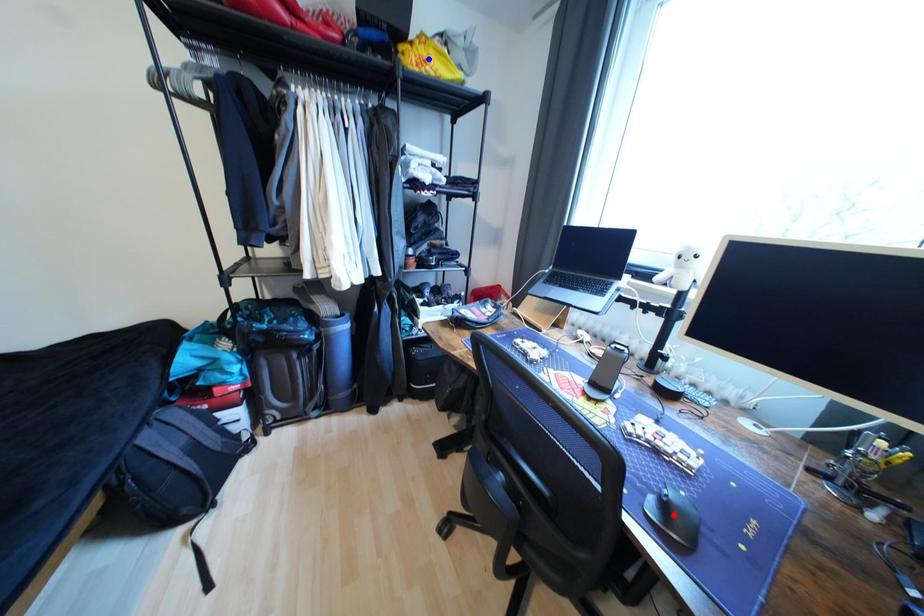
Question: In the image, two points are highlighted. Which point is nearer to the camera? Reply with the corresponding letter.

Choices:
 (A) blue point
 (B) red point

Answer: (B)